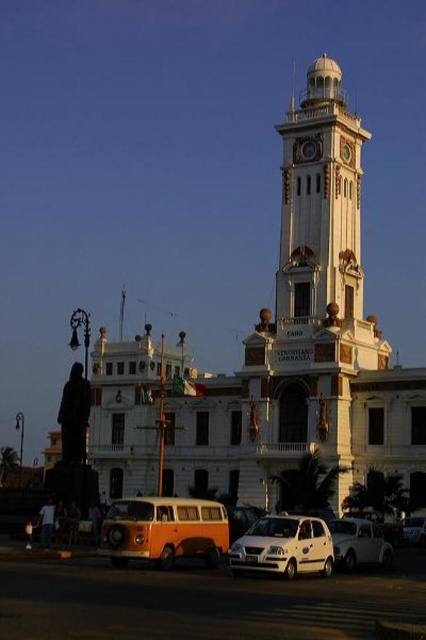
Does white painted stone clock tower at upper center appear over white matte car at lower center?

Yes.

Can you confirm if white painted stone clock tower at upper center is smaller than white matte car at lower center?

Actually, white painted stone clock tower at upper center might be larger than white matte car at lower center.

Between point (333, 262) and point (301, 525), which one is positioned in front?

Point (301, 525) is more forward.

Find the location of `white painted stone clock tower at upper center`. white painted stone clock tower at upper center is located at coordinates (310, 300).

Measure the distance between white matte car at lower center and camera.

They are 167.30 feet apart.

Is white matte car at lower center thinner than white matte car at lower right?

In fact, white matte car at lower center might be wider than white matte car at lower right.

Image resolution: width=426 pixels, height=640 pixels. Describe the element at coordinates (284, 547) in the screenshot. I see `white matte car at lower center` at that location.

Identify the location of white matte car at lower center. (284, 547).

Is white matte car at lower center thinner than white matte car at center?

Incorrect, white matte car at lower center's width is not less than white matte car at center's.

The image size is (426, 640). I want to click on white matte car at lower center, so click(x=284, y=547).